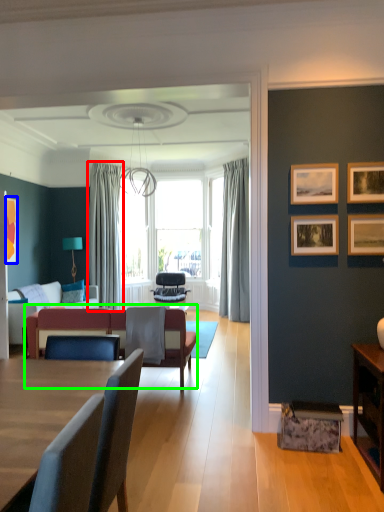
Question: Which is farther away from curtain (highlighted by a red box)? picture frame (highlighted by a blue box) or couch (highlighted by a green box)?

Choices:
 (A) picture frame
 (B) couch

Answer: (B)